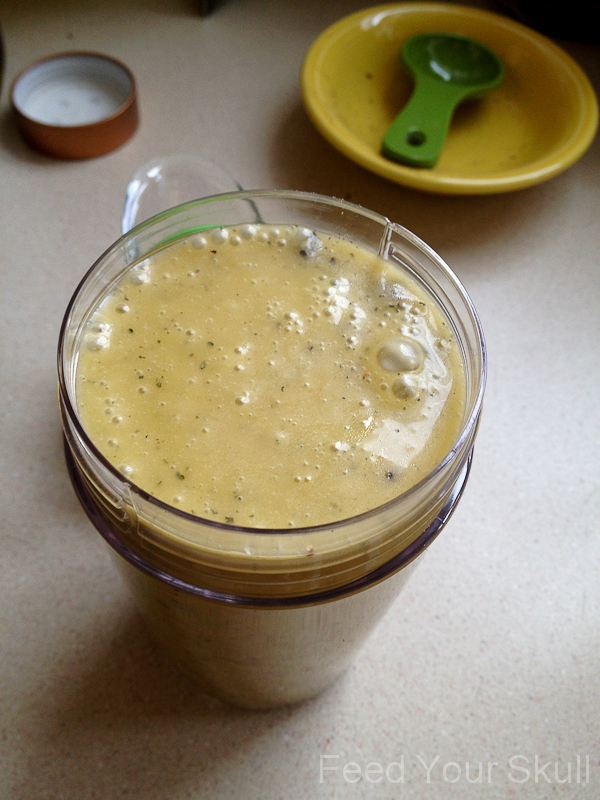
This screenshot has height=800, width=600. I want to click on handle, so click(429, 117), click(175, 182).